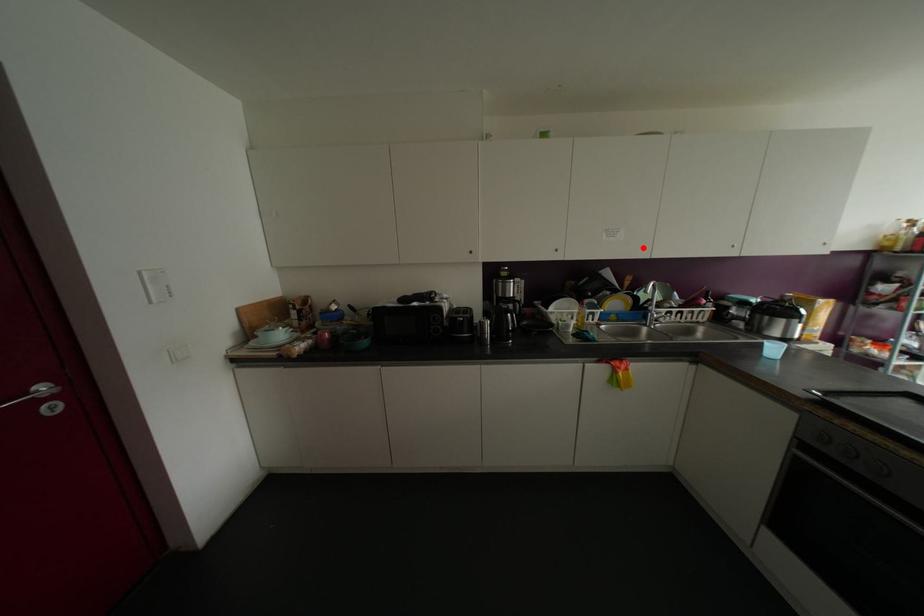
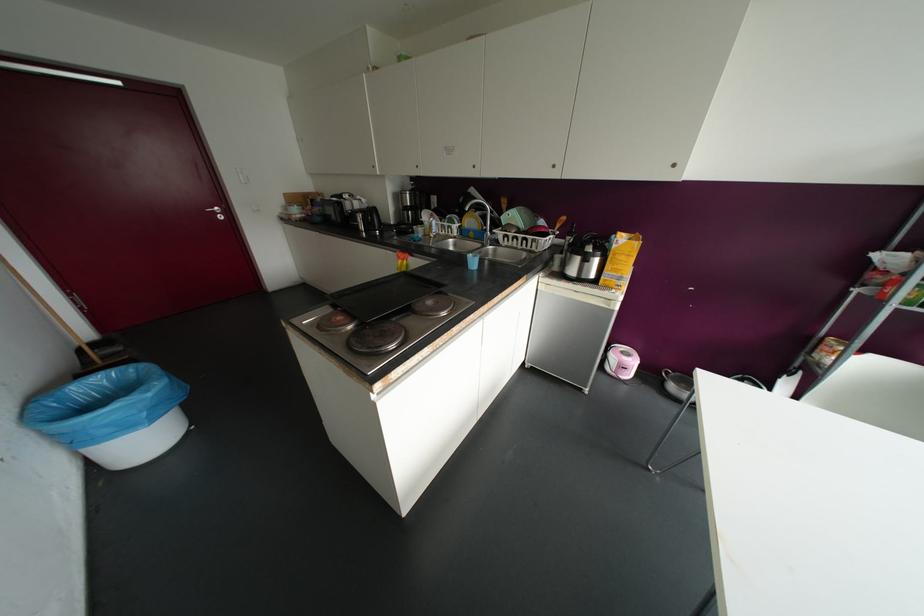
Where in the second image is the point corresponding to the highlighted location from the first image?

(473, 166)